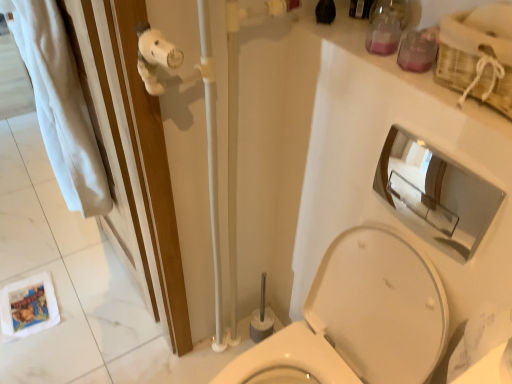
Question: Can you confirm if pink glass jar at upper right, placed as the second toiletry when sorted from bottom to top, is smaller than translucent plastic container at upper right, the second toiletry in the top-to-bottom sequence?

Choices:
 (A) yes
 (B) no

Answer: (B)

Question: Can you confirm if pink glass jar at upper right, the 2th toiletry positioned from the front, is positioned to the right of translucent plastic container at upper right, acting as the 1th toiletry starting from the front?

Choices:
 (A) no
 (B) yes

Answer: (A)

Question: Does pink glass jar at upper right, the 2th toiletry positioned from the front, lie behind translucent plastic container at upper right, acting as the first toiletry starting from the bottom?

Choices:
 (A) no
 (B) yes

Answer: (B)

Question: Is pink glass jar at upper right, the 2th toiletry positioned from the front, not within translucent plastic container at upper right, which is the 2th toiletry from back to front?

Choices:
 (A) no
 (B) yes

Answer: (B)

Question: Would you consider pink glass jar at upper right, acting as the 1th toiletry starting from the top, to be distant from translucent plastic container at upper right, acting as the first toiletry starting from the bottom?

Choices:
 (A) yes
 (B) no

Answer: (B)

Question: From the image's perspective, is pink glass jar at upper right, the 2th toiletry positioned from the front, above translucent plastic container at upper right, the second toiletry in the top-to-bottom sequence?

Choices:
 (A) yes
 (B) no

Answer: (A)

Question: From the image's perspective, is chrome/metallic mirror at upper right located above white plush toy at upper left?

Choices:
 (A) no
 (B) yes

Answer: (B)

Question: Does chrome/metallic mirror at upper right contain white plush toy at upper left?

Choices:
 (A) yes
 (B) no

Answer: (B)

Question: Considering the relative sizes of chrome/metallic mirror at upper right and white plush toy at upper left in the image provided, is chrome/metallic mirror at upper right thinner than white plush toy at upper left?

Choices:
 (A) no
 (B) yes

Answer: (B)

Question: Can you confirm if chrome/metallic mirror at upper right is wider than white plush toy at upper left?

Choices:
 (A) yes
 (B) no

Answer: (B)

Question: Is chrome/metallic mirror at upper right positioned with its back to white plush toy at upper left?

Choices:
 (A) no
 (B) yes

Answer: (A)

Question: Is chrome/metallic mirror at upper right not inside white plush toy at upper left?

Choices:
 (A) no
 (B) yes

Answer: (B)

Question: Is pink glass jar at upper right, arranged as the first toiletry when viewed from the back, located within white glossy toilet at center?

Choices:
 (A) yes
 (B) no

Answer: (B)